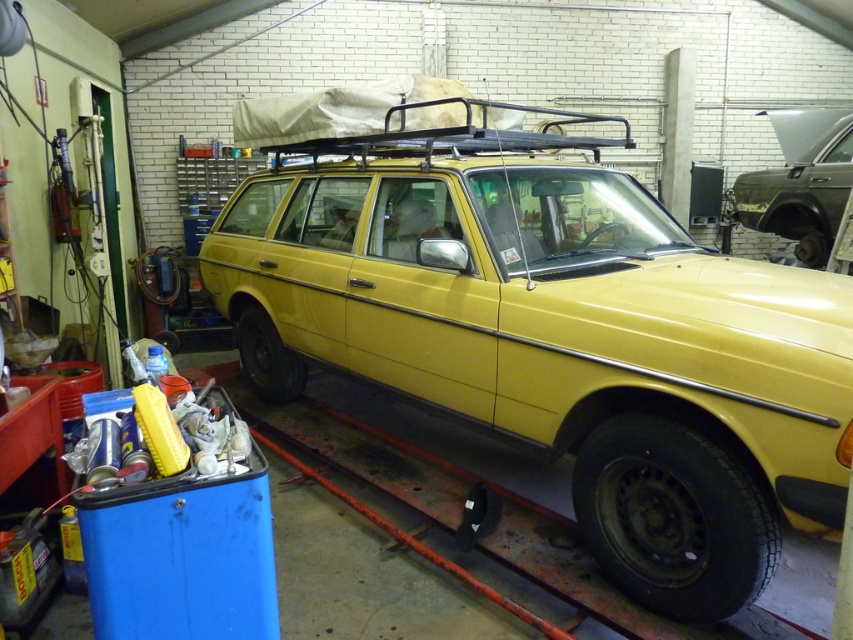
You are a mechanic working in a garage. You need to locate the yellow matte station wagon at center for a repair. Using the coordinate system where the bottom left corner is the origin, can you confirm if the station wagon is positioned at point (556, 337)?

Yes, the point (556, 337) marks the yellow matte station wagon at center, so it is correctly positioned there.